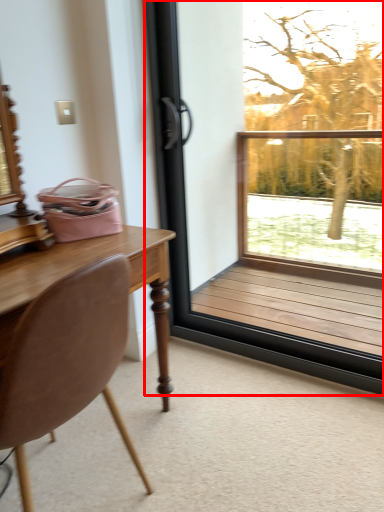
Question: From the image's perspective, what is the correct spatial positioning of window (annotated by the red box) in reference to chair?

Choices:
 (A) below
 (B) above

Answer: (B)